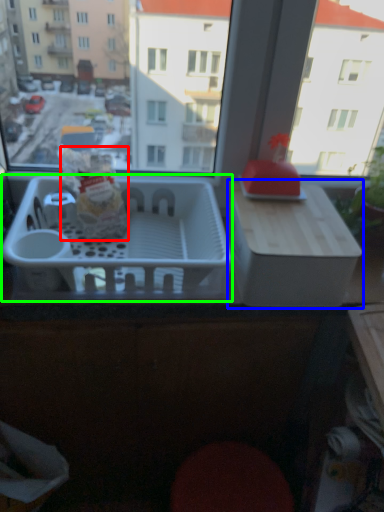
Question: Which object is the closest to the snack (highlighted by a red box)? Choose among these: cardboard box (highlighted by a blue box) or basket (highlighted by a green box).

Choices:
 (A) cardboard box
 (B) basket

Answer: (B)